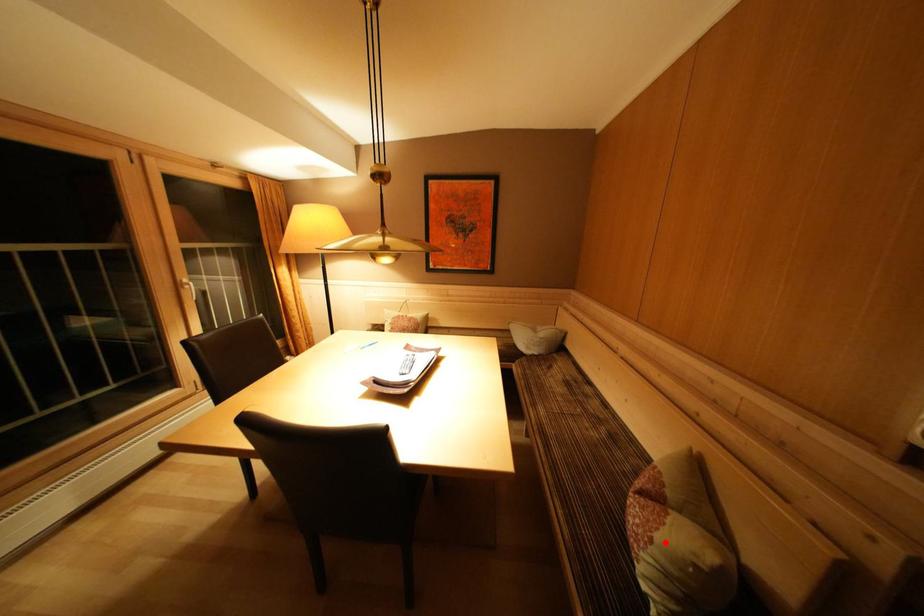
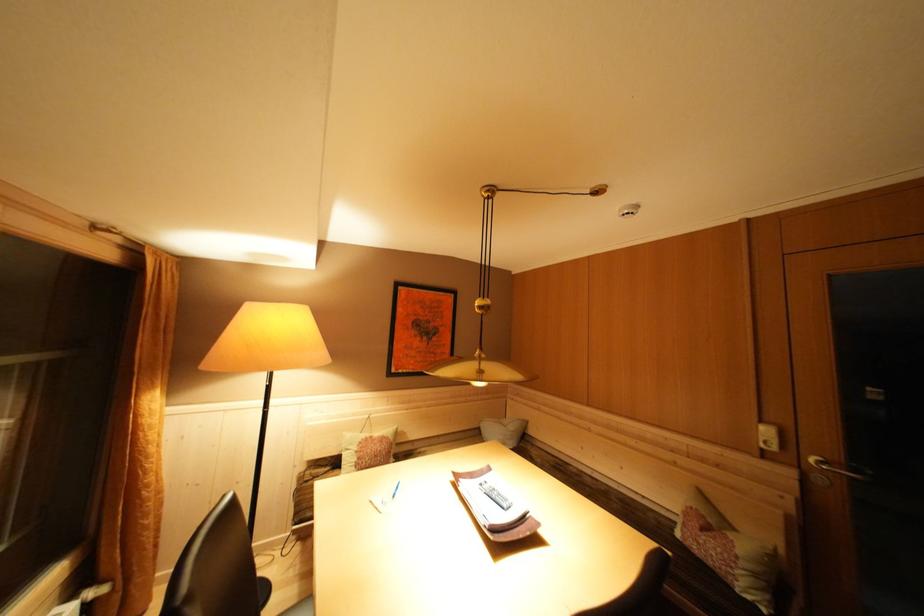
Question: I am providing you with two images of the same scene from different viewpoints. A red point is shown in image1. For the corresponding object point in image2, is it positioned nearer or farther from the camera?

Choices:
 (A) Nearer
 (B) Farther

Answer: (A)